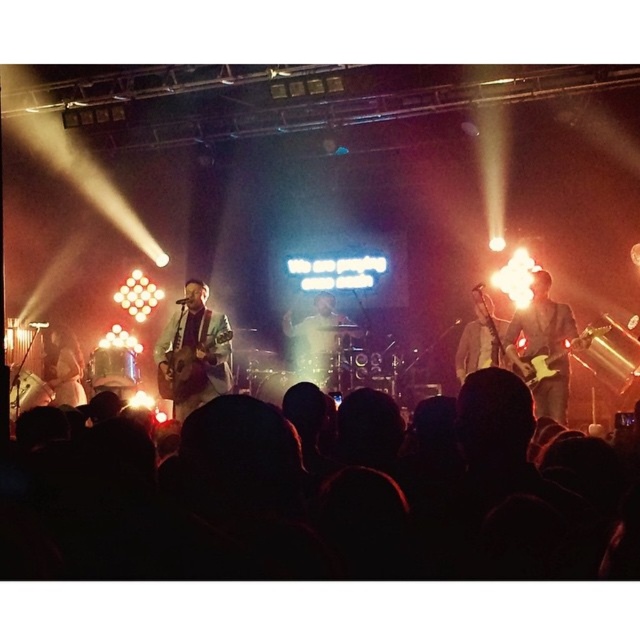
You are a photographer standing at the back of the venue. You want to take a photo that includes both the matte brown guitar at right and the white fabric shirt at left. The camera you have can focus on objects within a 4.5 meter range. Will both subjects be in focus?

The distance between the matte brown guitar at right and the white fabric shirt at left is 5.04 meters. Since the camera can only focus within 4.5 meters, the two subjects are too far apart for both to be in focus simultaneously.

You are a photographer trying to capture the best shot of the performance. You notice two points on the stage, point 1 at coordinates point (200,296) and point 2 at coordinates point (48,349). Which point should you focus on to ensure it appears larger in your photo?

Point 1 at coordinates point (200,296) is closer to the camera than point 2 at coordinates point (48,349), so focusing on point 1 will make it appear larger in the photo.

You are a photographer at the concert venue and want to capture a close shot of the drummer. You have two points marked on your camera screen to focus on. One is point (540, 320) and the other is point (332, 362). Which point should you choose to focus on to get a clearer image of the drummer?

Point (540, 320) is closer to the viewer than point (332, 362). Therefore, focusing on point (540, 320) will provide a clearer image of the drummer.